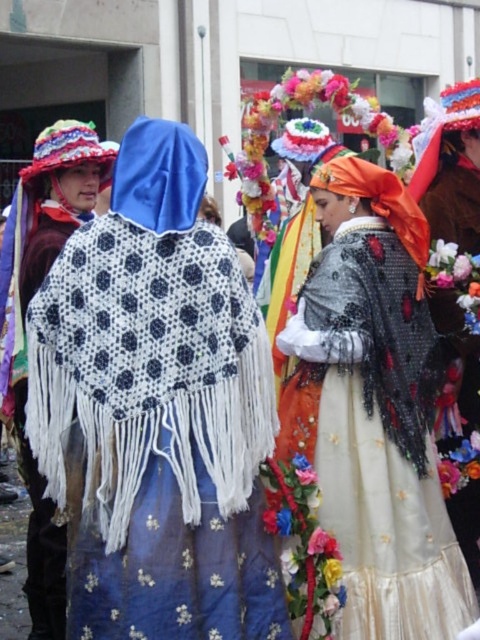
From the picture: You are a photographer trying to capture both the shiny orange fabric at center and the white knitted shawl at left in the same frame. Based on their heights, which one should you focus on first to ensure both are in the shot?

The shiny orange fabric at center is shorter than the white knitted shawl at left, so you should focus on the taller white knitted shawl at left first to ensure both are in the shot.

You are a photographer trying to capture both the white knitted shawl at left and the floral lace dress at center in a single frame. Based on their heights, which object should you focus on first to ensure both are in the shot?

The white knitted shawl at left is taller than the floral lace dress at center, so you should focus on the white knitted shawl at left first to ensure both are in the shot.